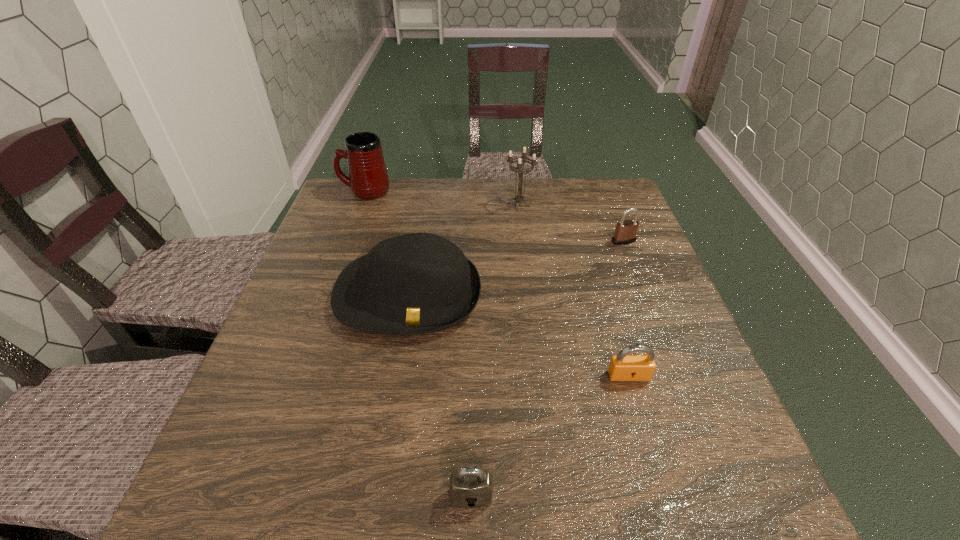
The height and width of the screenshot is (540, 960). I want to click on free space between the second padlock from right to left and the farthest padlock, so click(x=626, y=308).

Identify the location of free space between the mug and the fourth object from left to right. The width and height of the screenshot is (960, 540). (442, 198).

You are a GUI agent. You are given a task and a screenshot of the screen. Output one action in this format:
    pyautogui.click(x=<x>, y=<y>)
    Task: Click on the free spot between the third object from right to left and the second nearest object
    The width and height of the screenshot is (960, 540).
    Given the screenshot: What is the action you would take?
    coord(574,291)

The image size is (960, 540). I want to click on the closest object to the third nearest object, so click(519, 198).

Find the location of a particular element. object that is the third closest one to the rightmost object is located at coordinates (623, 367).

Choose which padlock is the nearest neighbor to the candle holder. Please provide its 2D coordinates. Your answer should be formatted as a tuple, i.e. [(x, y)], where the tuple contains the x and y coordinates of a point satisfying the conditions above.

[(625, 233)]

Find the location of a particular element. The image size is (960, 540). padlock that is the closest to the fourth object from left to right is located at coordinates (625, 233).

Where is `vacant space that satisfies the following two spatial constraints: 1. on the side of the mug with the handle; 2. on the right side of the third farthest object`? vacant space that satisfies the following two spatial constraints: 1. on the side of the mug with the handle; 2. on the right side of the third farthest object is located at coordinates (347, 241).